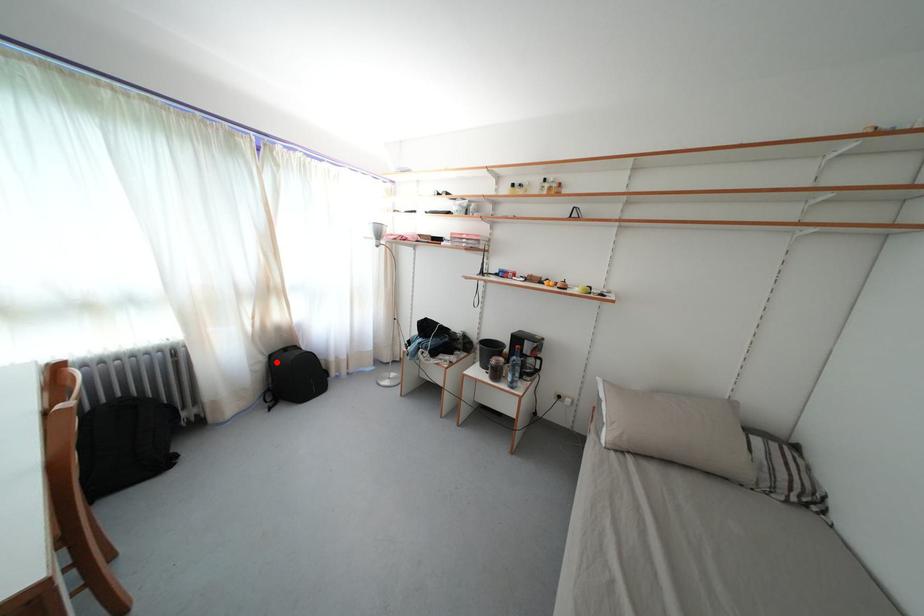
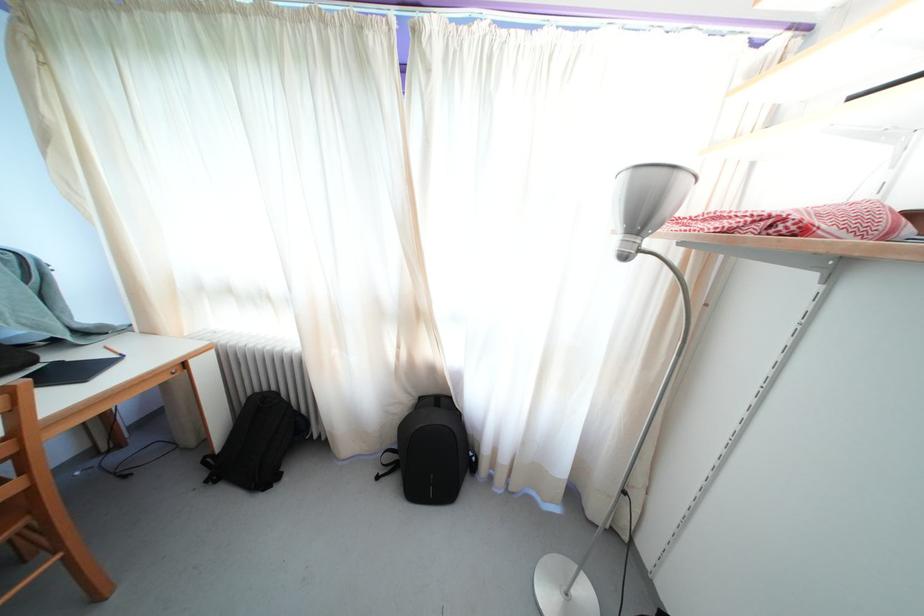
Find the pixel in the second image that matches the highlighted location in the first image.

(427, 405)